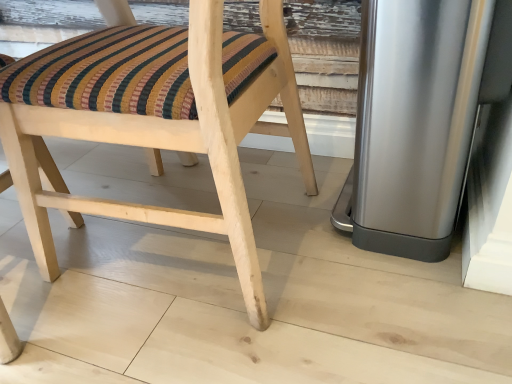
In order to face polished stainless steel trash can at right, should I rotate leftwards or rightwards?

A 21.021 degree turn to the right will do.

The width and height of the screenshot is (512, 384). What are the coordinates of `polished stainless steel trash can at right` in the screenshot? It's located at (414, 124).

What do you see at coordinates (414, 124) in the screenshot? I see `polished stainless steel trash can at right` at bounding box center [414, 124].

What is the approximate height of polished stainless steel trash can at right?

The height of polished stainless steel trash can at right is 52.74 centimeters.

The height and width of the screenshot is (384, 512). What are the coordinates of `natural wood chair at center` in the screenshot? It's located at (152, 119).

Describe the element at coordinates (152, 119) in the screenshot. I see `natural wood chair at center` at that location.

This screenshot has height=384, width=512. Identify the location of polished stainless steel trash can at right. pyautogui.click(x=414, y=124).

Would you say natural wood chair at center is to the left or to the right of polished stainless steel trash can at right in the picture?

Clearly, natural wood chair at center is on the left of polished stainless steel trash can at right in the image.

Is the position of natural wood chair at center less distant than that of polished stainless steel trash can at right?

Yes.

Which is in front, point (91, 113) or point (367, 128)?

Point (91, 113)

From the image's perspective, would you say natural wood chair at center is shown under polished stainless steel trash can at right?

Correct, natural wood chair at center appears lower than polished stainless steel trash can at right in the image.

From a real-world perspective, who is located lower, natural wood chair at center or polished stainless steel trash can at right?

polished stainless steel trash can at right.

Between natural wood chair at center and polished stainless steel trash can at right, which one has larger width?

With larger width is natural wood chair at center.

From the picture: Between natural wood chair at center and polished stainless steel trash can at right, which one has more height?

natural wood chair at center.

Can you confirm if natural wood chair at center is bigger than polished stainless steel trash can at right?

Yes, natural wood chair at center is bigger than polished stainless steel trash can at right.

Does natural wood chair at center contain polished stainless steel trash can at right?

No, polished stainless steel trash can at right is located outside of natural wood chair at center.

Are natural wood chair at center and polished stainless steel trash can at right beside each other?

No, natural wood chair at center is not beside polished stainless steel trash can at right.

Could you tell me if natural wood chair at center is turned towards polished stainless steel trash can at right?

No, natural wood chair at center is not turned towards polished stainless steel trash can at right.

What's the angular difference between natural wood chair at center and polished stainless steel trash can at right's facing directions?

There is a 91-degree angle between the facing directions of natural wood chair at center and polished stainless steel trash can at right.

This screenshot has height=384, width=512. What are the coordinates of `appliance on the right of natural wood chair at center` in the screenshot? It's located at (414, 124).

Which is more to the right, polished stainless steel trash can at right or natural wood chair at center?

polished stainless steel trash can at right.

Relative to natural wood chair at center, is polished stainless steel trash can at right in front or behind?

In the image, polished stainless steel trash can at right appears behind natural wood chair at center.

Considering the points (425, 7) and (158, 221), which point is in front, point (425, 7) or point (158, 221)?

The point (425, 7) is more forward.

From the image's perspective, which is above, polished stainless steel trash can at right or natural wood chair at center?

polished stainless steel trash can at right appears higher in the image.

From a real-world perspective, who is located lower, polished stainless steel trash can at right or natural wood chair at center?

polished stainless steel trash can at right is physically lower.

Is polished stainless steel trash can at right thinner than natural wood chair at center?

Correct, the width of polished stainless steel trash can at right is less than that of natural wood chair at center.

Considering the sizes of objects polished stainless steel trash can at right and natural wood chair at center in the image provided, who is shorter, polished stainless steel trash can at right or natural wood chair at center?

polished stainless steel trash can at right is shorter.

In terms of size, does polished stainless steel trash can at right appear bigger or smaller than natural wood chair at center?

polished stainless steel trash can at right is smaller than natural wood chair at center.

Is natural wood chair at center surrounded by polished stainless steel trash can at right?

That's incorrect, natural wood chair at center is not inside polished stainless steel trash can at right.

Is the surface of polished stainless steel trash can at right in direct contact with natural wood chair at center?

No, polished stainless steel trash can at right is not beside natural wood chair at center.

Is polished stainless steel trash can at right aimed at natural wood chair at center?

No, polished stainless steel trash can at right does not turn towards natural wood chair at center.

How different are the orientations of polished stainless steel trash can at right and natural wood chair at center in degrees?

91 degrees.

This screenshot has height=384, width=512. In the image, there is a natural wood chair at center. Identify the location of appliance above it (from the image's perspective). (414, 124).

Locate an element on the screen. This screenshot has width=512, height=384. chair above the polished stainless steel trash can at right (from a real-world perspective) is located at coordinates (152, 119).

Locate an element on the screen. Image resolution: width=512 pixels, height=384 pixels. appliance located on the right of natural wood chair at center is located at coordinates (414, 124).